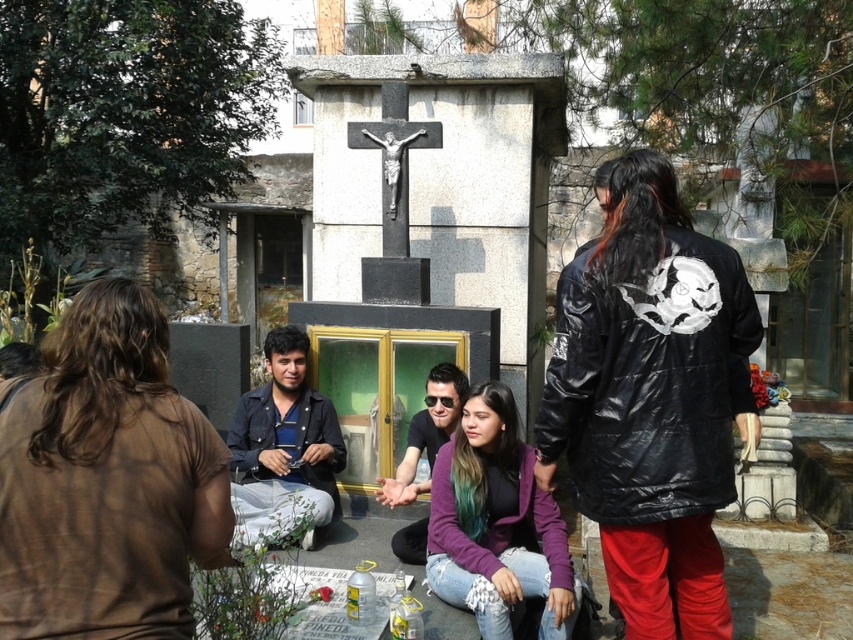
You are a photographer trying to capture a closeup of both the denim jacket at center and the black matte sunglasses at center in the scene. Can you fit both items into your camera frame if your camera has a minimum focus distance of 20 inches?

The denim jacket at center and the black matte sunglasses at center are 21.47 inches apart from each other. Since the minimum focus distance is 20 inches, the camera can focus on both items as they are within the required distance.